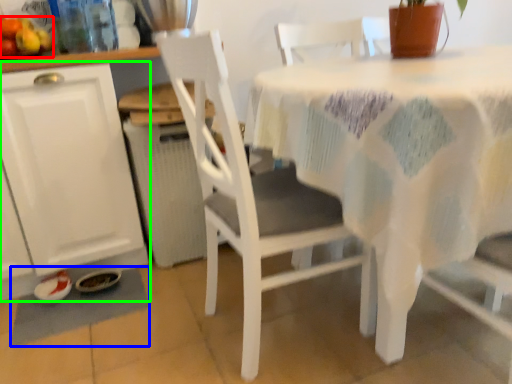
Question: Considering the real-world distances, which object is farthest from fruit (highlighted by a red box)? place mat (highlighted by a blue box) or cabinetry (highlighted by a green box)?

Choices:
 (A) place mat
 (B) cabinetry

Answer: (A)